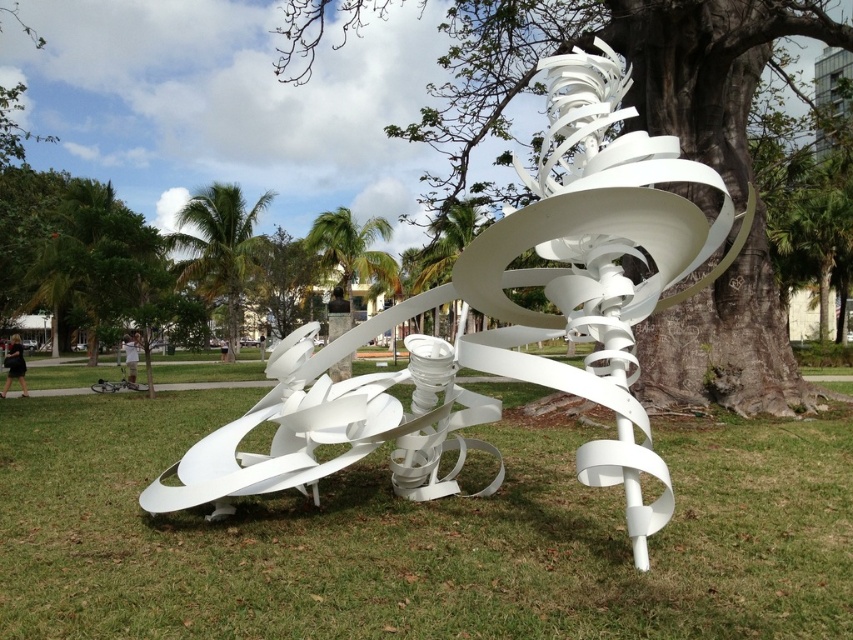
Question: Is green grass at center further to the viewer compared to brown textured tree at center?

Choices:
 (A) yes
 (B) no

Answer: (B)

Question: Which object appears farthest from the camera in this image?

Choices:
 (A) brown textured tree at center
 (B) white matte sculpture at center
 (C) green leafy palm tree at upper left

Answer: (C)

Question: Which point is closer to the camera taking this photo?

Choices:
 (A) (328, 356)
 (B) (730, 72)
 (C) (222, 212)
 (D) (503, 634)

Answer: (D)

Question: Does green grass at center appear under brown textured tree at center?

Choices:
 (A) yes
 (B) no

Answer: (A)

Question: Can you confirm if brown textured tree at center is bigger than green leafy palm tree at upper left?

Choices:
 (A) no
 (B) yes

Answer: (B)

Question: Which point appears farthest from the camera in this image?

Choices:
 (A) (631, 486)
 (B) (219, 230)
 (C) (751, 237)
 (D) (68, 419)

Answer: (B)